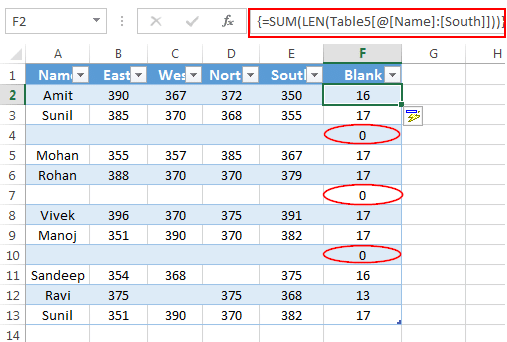
You are a GUI agent. You are given a task and a screenshot of the screen. Output one action in this format:
    pyautogui.click(x=<x>, y=<y>)
    Task: Click on the column
    The height and width of the screenshot is (342, 507).
    Given the screenshot: What is the action you would take?
    pyautogui.click(x=7, y=55), pyautogui.click(x=32, y=50), pyautogui.click(x=116, y=52), pyautogui.click(x=157, y=55), pyautogui.click(x=209, y=52), pyautogui.click(x=273, y=48), pyautogui.click(x=333, y=51), pyautogui.click(x=410, y=50), pyautogui.click(x=475, y=51)